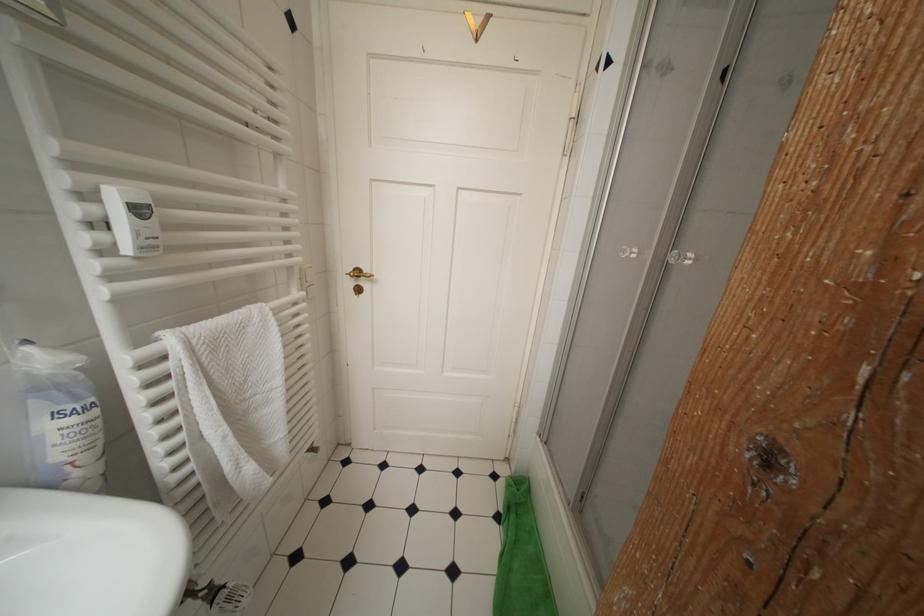
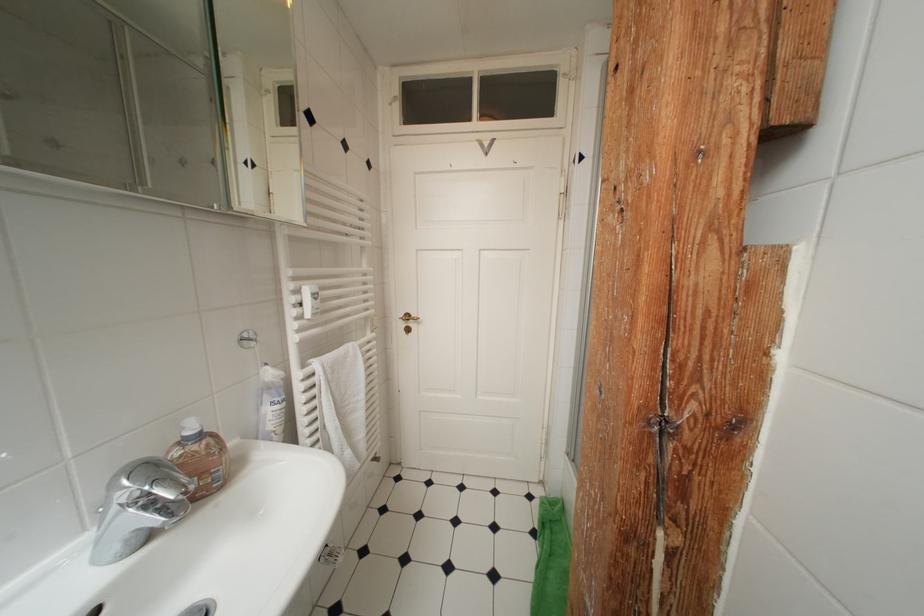
Find the pixel in the second image that matches point (365, 276) in the first image.

(415, 320)